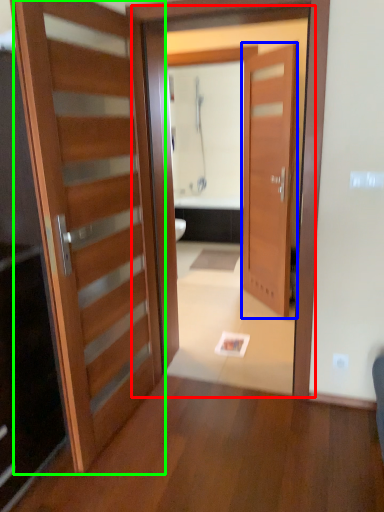
Question: Based on their relative distances, which object is farther from screen door (highlighted by a red box)? Choose from door (highlighted by a blue box) and door (highlighted by a green box).

Choices:
 (A) door
 (B) door

Answer: (A)